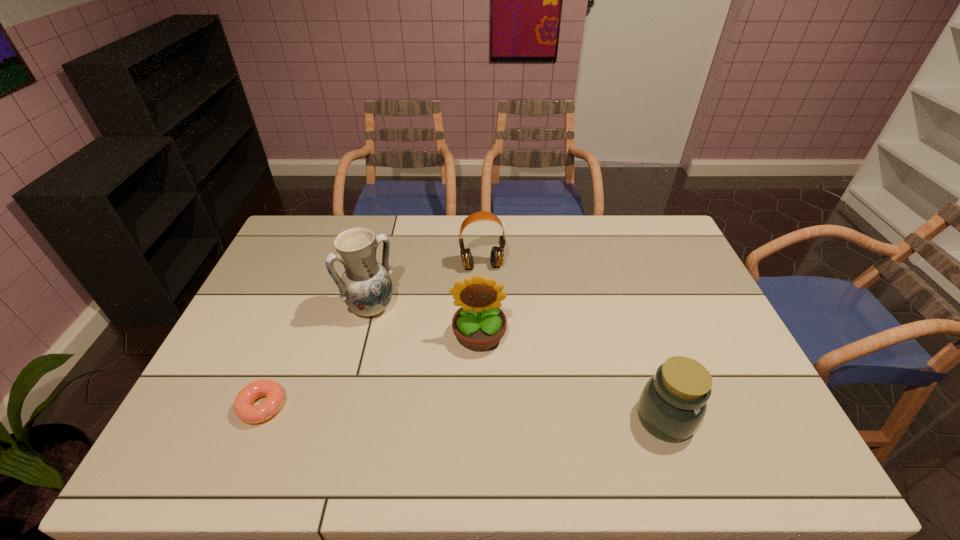
Where is `free point between the doughnut and the sunflower`? The height and width of the screenshot is (540, 960). free point between the doughnut and the sunflower is located at coordinates (371, 371).

The image size is (960, 540). I want to click on free space between the farthest object and the rightmost object, so click(x=573, y=342).

Identify the location of unoccupied area between the second object from left to right and the farthest object. (426, 287).

You are a GUI agent. You are given a task and a screenshot of the screen. Output one action in this format:
    pyautogui.click(x=<x>, y=<y>)
    Task: Click on the free space between the rightmost object and the second object from left to right
    Image resolution: width=960 pixels, height=540 pixels.
    Given the screenshot: What is the action you would take?
    pyautogui.click(x=518, y=363)

You are a GUI agent. You are given a task and a screenshot of the screen. Output one action in this format:
    pyautogui.click(x=<x>, y=<y>)
    Task: Click on the free point between the sunflower and the doughnut
    
    Given the screenshot: What is the action you would take?
    pyautogui.click(x=371, y=371)

Point out which object is positioned as the second nearest to the sunflower. Please provide its 2D coordinates. Your answer should be formatted as a tuple, i.e. [(x, y)], where the tuple contains the x and y coordinates of a point satisfying the conditions above.

[(497, 253)]

This screenshot has height=540, width=960. I want to click on object that stands as the third closest to the shortest object, so click(x=497, y=253).